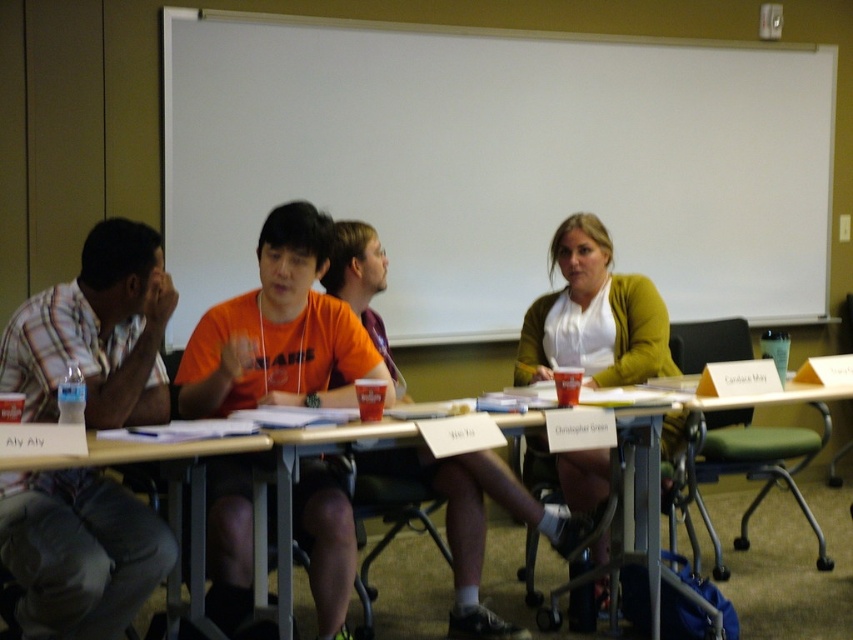
You are a photographer setting up for a group photo. You need to position your camera so that both the orange cotton shirt at center and the wooden table at lower left are in frame. Which object should you focus on first to ensure both are in focus?

The orange cotton shirt at center is taller than the wooden table at lower left, so you should focus on the orange cotton shirt at center first to ensure both are in focus.

You are attending a meeting in a classroom and notice an orange cotton shirt at center and a metallic silver table at center. Which object is closer to you if you are looking directly at the front of the room?

The orange cotton shirt at center is closer to you because it is located above the metallic silver table at center, meaning it is positioned in front of the table from your perspective.